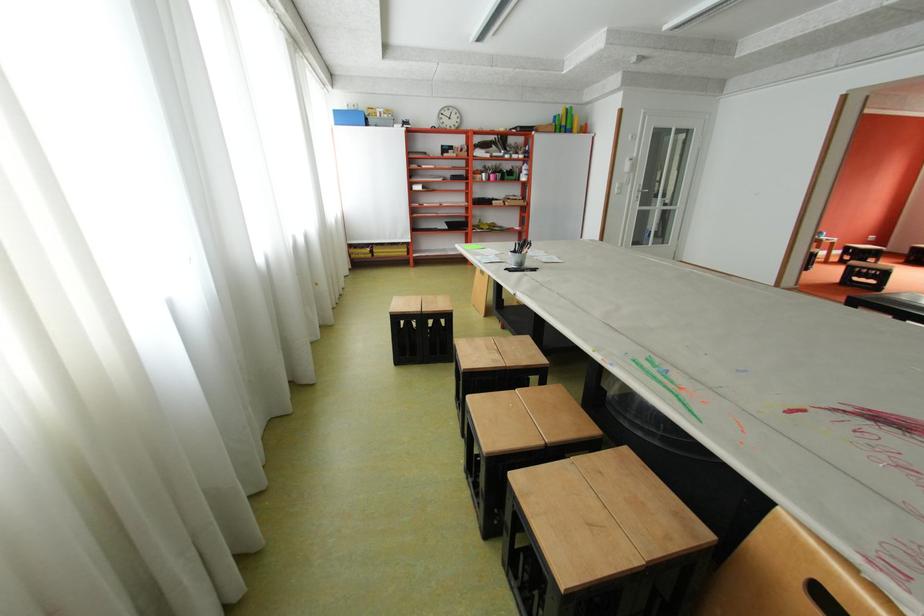
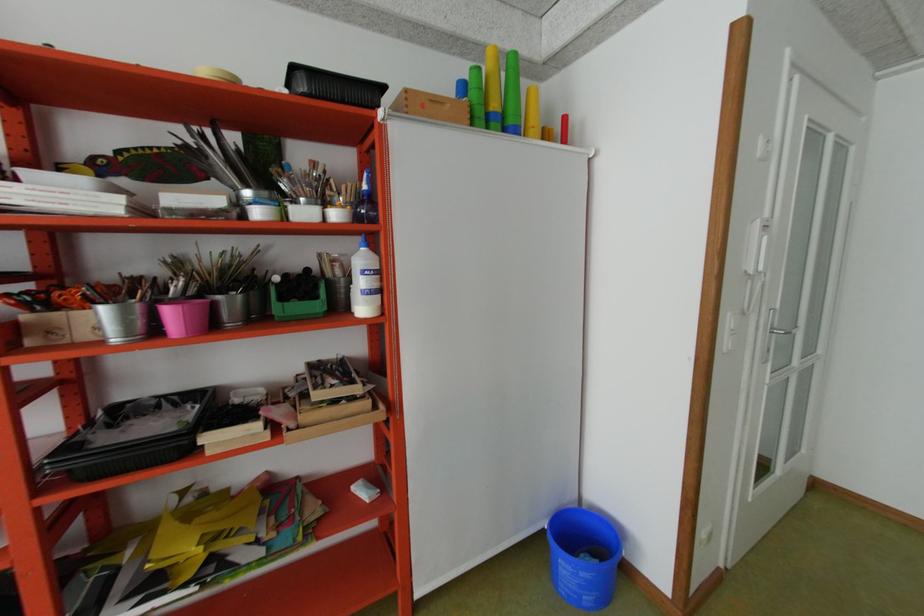
Find the pixel in the second image that matches the point at 535,169 in the first image.

(372, 273)